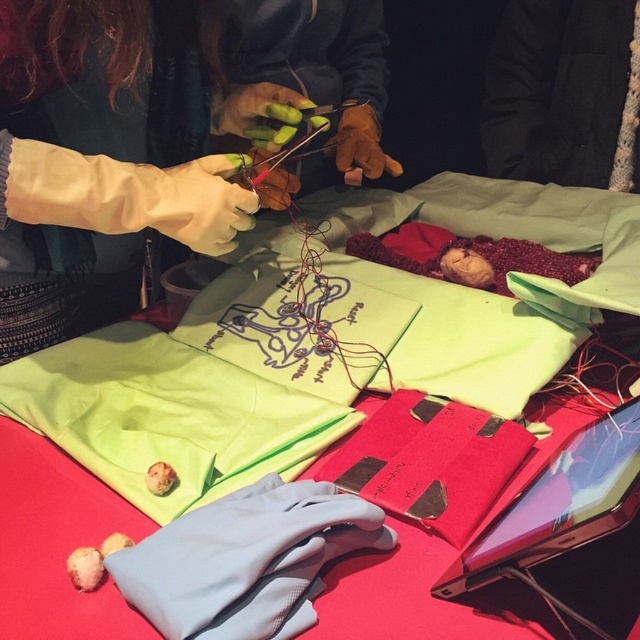
Question: Which of the following is the closest to the observer?

Choices:
 (A) gray fleece glove at lower left
 (B) matte green fabric at center
 (C) matte yellow gloves at center
 (D) green fabric at center

Answer: (A)

Question: Which point is closer to the camera?

Choices:
 (A) black fabric at upper right
 (B) matte green fabric at center

Answer: (B)

Question: Does green fabric at center appear under gray fleece glove at lower left?

Choices:
 (A) yes
 (B) no

Answer: (B)

Question: Which object is positioned closest to the matte yellow gloves at center?

Choices:
 (A) gray fleece glove at lower left
 (B) black fabric at upper right

Answer: (B)

Question: Can you confirm if gray fleece glove at lower left is thinner than matte yellow gloves at center?

Choices:
 (A) yes
 (B) no

Answer: (A)

Question: Can you confirm if gray fleece glove at lower left is positioned to the left of matte yellow gloves at center?

Choices:
 (A) yes
 (B) no

Answer: (A)